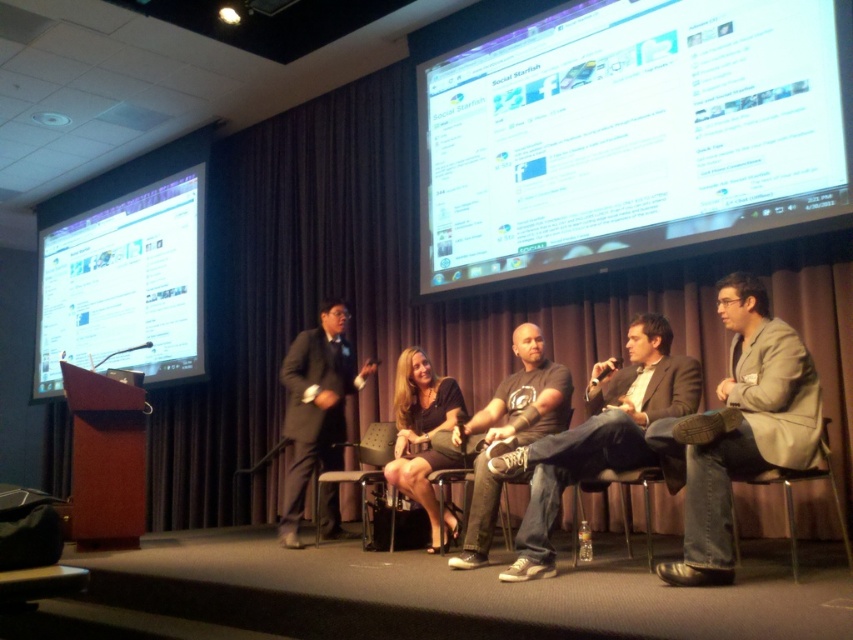
Is light gray suit at right taller than dark gray t-shirt at center?

Yes, light gray suit at right is taller than dark gray t-shirt at center.

Between point (805, 442) and point (524, 410), which one is positioned in front?

Point (805, 442)

What do you see at coordinates (741, 428) in the screenshot? I see `light gray suit at right` at bounding box center [741, 428].

At what (x,y) coordinates should I click in order to perform the action: click on light gray suit at right. Please return your answer as a coordinate pair (x, y). This screenshot has width=853, height=640. Looking at the image, I should click on click(741, 428).

Does dark gray cotton t-shirt at center have a greater width compared to matte black suit at left?

Yes, dark gray cotton t-shirt at center is wider than matte black suit at left.

How distant is dark gray cotton t-shirt at center from matte black suit at left?

dark gray cotton t-shirt at center is 1.94 meters from matte black suit at left.

Between point (595, 392) and point (294, 467), which one is positioned behind?

Positioned behind is point (294, 467).

Where is `dark gray cotton t-shirt at center`? dark gray cotton t-shirt at center is located at coordinates (599, 435).

Who is positioned more to the left, matte black screen at left or dark gray t-shirt at center?

matte black screen at left is more to the left.

Does matte black screen at left appear on the right side of dark gray t-shirt at center?

Incorrect, matte black screen at left is not on the right side of dark gray t-shirt at center.

Identify the location of matte black screen at left. This screenshot has width=853, height=640. (125, 285).